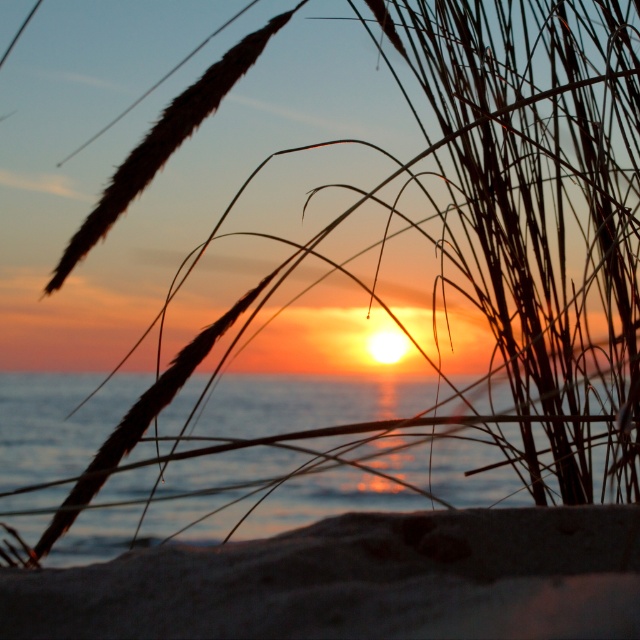
Who is positioned more to the left, dark brown sandy beach at lower center or translucent water at center?

translucent water at center is more to the left.

Between dark brown sandy beach at lower center and translucent water at center, which one has less height?

Standing shorter between the two is dark brown sandy beach at lower center.

Where is `dark brown sandy beach at lower center`? This screenshot has width=640, height=640. dark brown sandy beach at lower center is located at coordinates (356, 580).

Find the location of a particular element. The height and width of the screenshot is (640, 640). dark brown sandy beach at lower center is located at coordinates (356, 580).